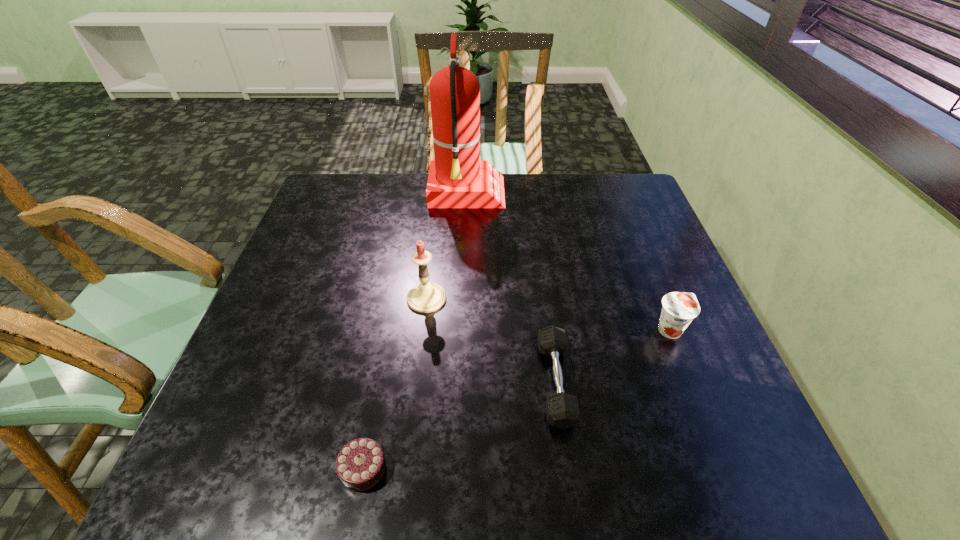
The width and height of the screenshot is (960, 540). Find the location of `blank space at the right edge`. blank space at the right edge is located at coordinates (659, 307).

In the image, there is a desktop. Find the location of `free space at the far left corner`. free space at the far left corner is located at coordinates (318, 210).

Locate an element on the screen. free point at the far right corner is located at coordinates pos(588,179).

What are the coordinates of `vacant region at the near right corner` in the screenshot? It's located at (683, 447).

Find the location of `vacant region between the tallest object and the fourth object from left to right`. vacant region between the tallest object and the fourth object from left to right is located at coordinates (511, 288).

Where is `vacant space in between the second farthest object and the fire extinguisher`? This screenshot has width=960, height=540. vacant space in between the second farthest object and the fire extinguisher is located at coordinates (446, 246).

Where is `vacant space that's between the yogurt and the dumbbell`? vacant space that's between the yogurt and the dumbbell is located at coordinates (612, 356).

Where is `free space between the farthest object and the yogurt`? free space between the farthest object and the yogurt is located at coordinates pyautogui.click(x=568, y=262).

You are a GUI agent. You are given a task and a screenshot of the screen. Output one action in this format:
    pyautogui.click(x=<x>, y=<y>)
    Task: Click on the free spot between the third tallest object and the candle
    This screenshot has height=540, width=960.
    Given the screenshot: What is the action you would take?
    pyautogui.click(x=548, y=314)

Find the location of a particular element. This screenshot has width=960, height=540. vacant space that's between the fourth shortest object and the third tallest object is located at coordinates (548, 314).